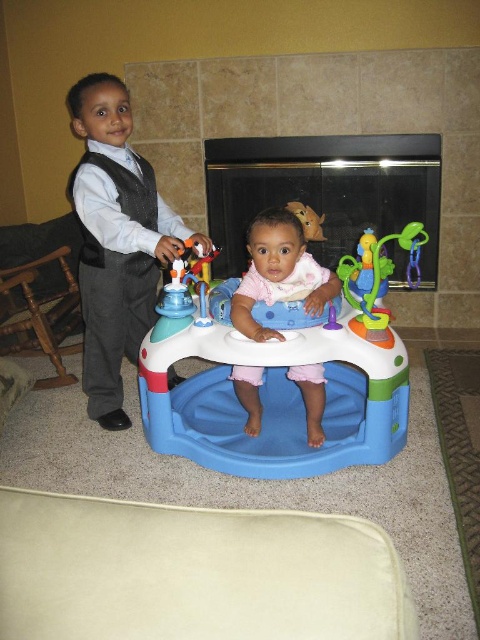
Question: Among these objects, which one is farthest from the camera?

Choices:
 (A) matte gray vest at left
 (B) blue plastic baby activity center at center
 (C) wooden chair at left

Answer: (C)

Question: Is blue plastic baby activity center at center below glassy black fireplace at center?

Choices:
 (A) yes
 (B) no

Answer: (A)

Question: Is blue plastic baby activity center at center above wooden chair at left?

Choices:
 (A) no
 (B) yes

Answer: (A)

Question: Estimate the real-world distances between objects in this image. Which object is closer to the translucent plastic toy at center?

Choices:
 (A) wooden chair at left
 (B) blue plastic baby activity center at center
 (C) pink fabric walker at center
 (D) matte gray vest at left

Answer: (C)

Question: Among these objects, which one is nearest to the camera?

Choices:
 (A) matte gray vest at left
 (B) translucent plastic toy at center

Answer: (B)

Question: Is blue plastic baby activity center at center above glassy black fireplace at center?

Choices:
 (A) no
 (B) yes

Answer: (A)